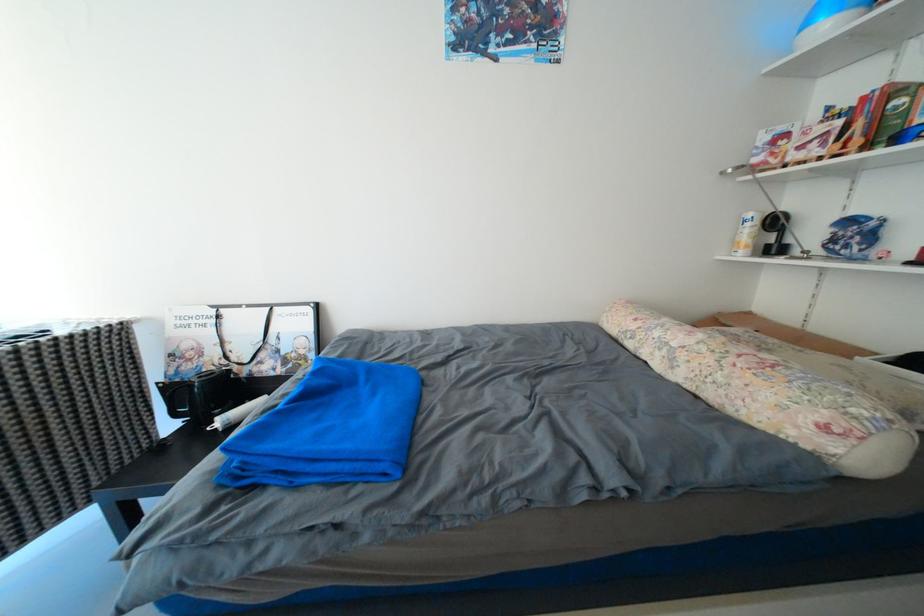
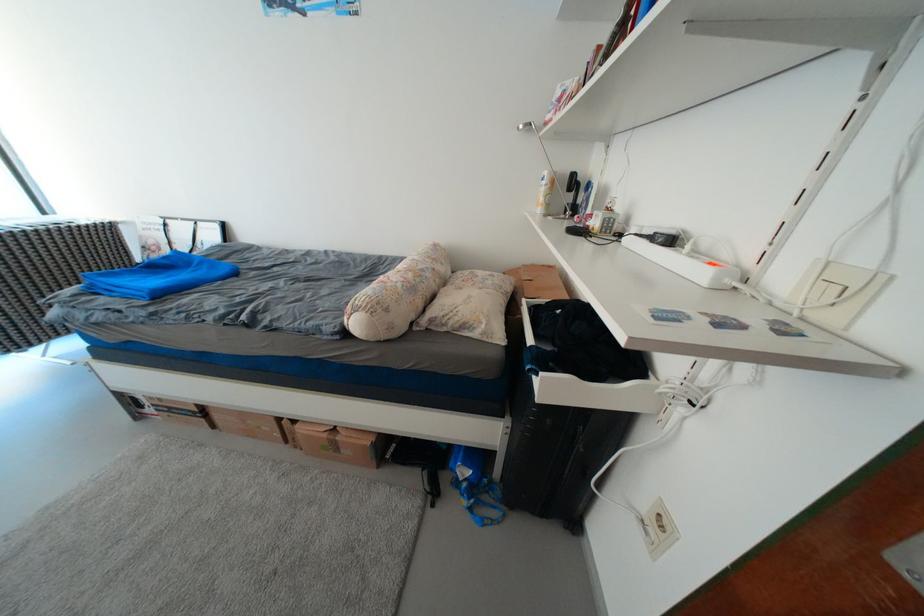
Find the pixel in the second image that matches point (757, 227) in the first image.

(553, 185)